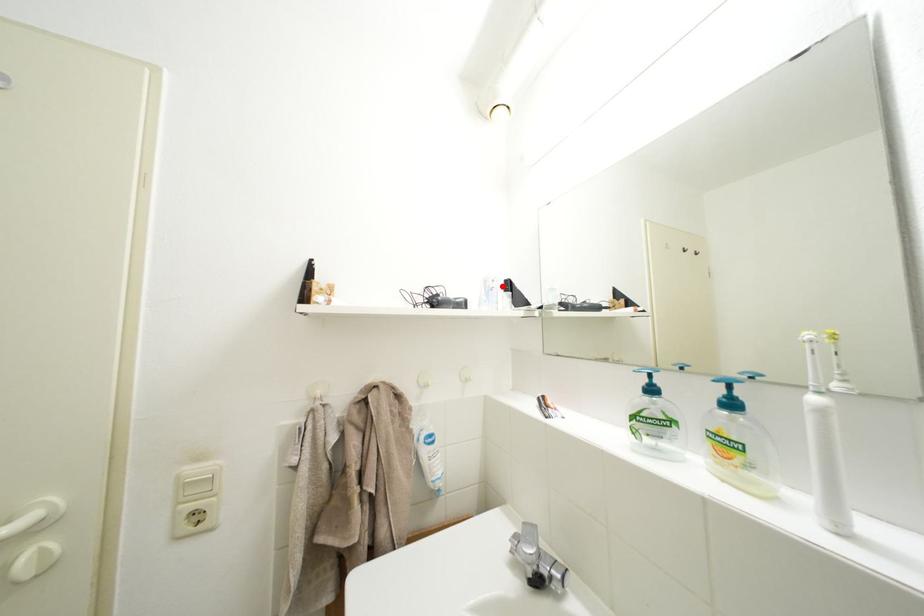
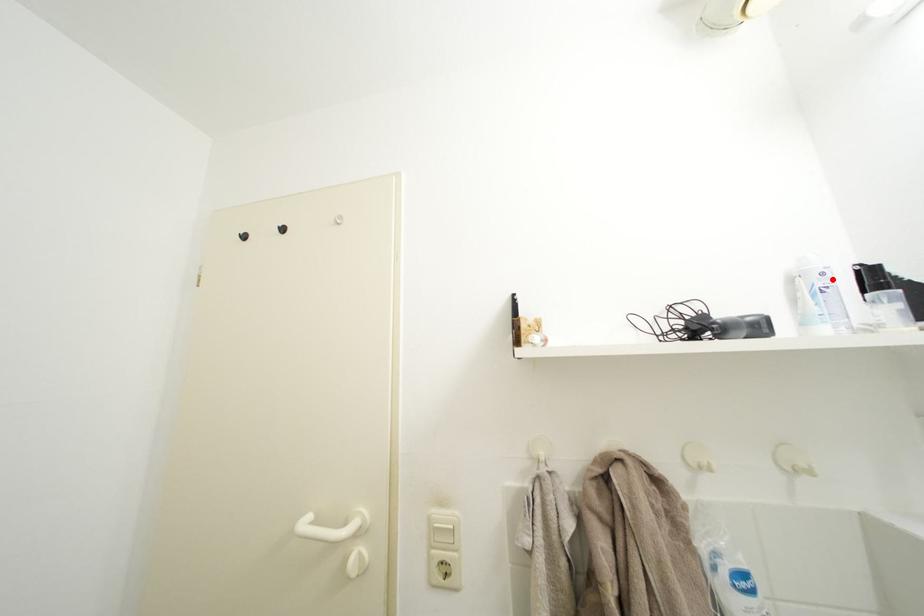
I am providing you with two images of the same scene from different viewpoints. A red point is marked on the first image and another point is marked on the second image. Does the point marked in image1 correspond to the same location as the one in image2?

Yes